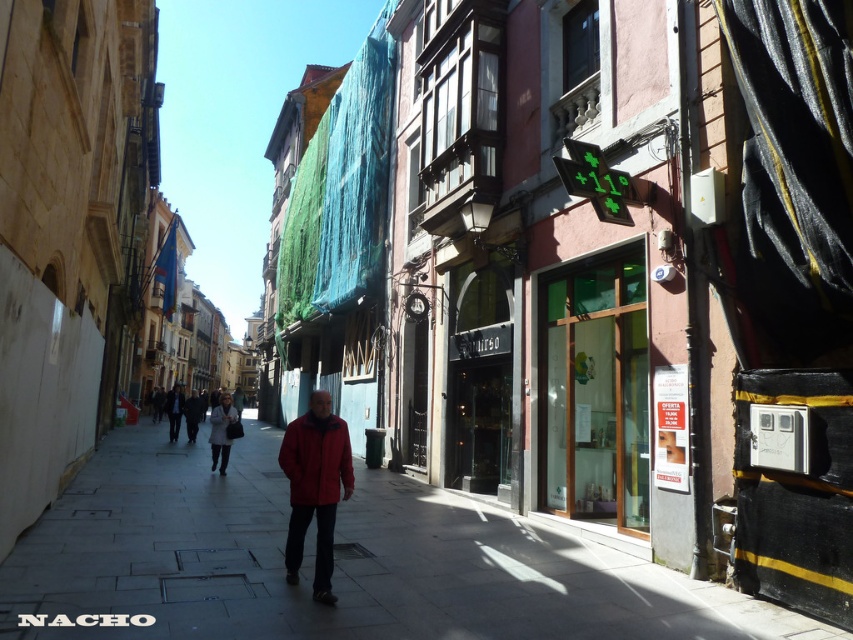
Can you confirm if red matte jacket at center is smaller than matte black jacket at center?

Incorrect, red matte jacket at center is not smaller in size than matte black jacket at center.

Between red matte jacket at center and matte black jacket at center, which one has more height?

red matte jacket at center is taller.

Is point (329, 496) more distant than point (225, 408)?

No, it is not.

Find the location of `red matte jacket at center`. red matte jacket at center is located at coordinates (315, 486).

Can you confirm if gray concrete pavement at center is positioned to the right of red matte jacket at center?

Incorrect, gray concrete pavement at center is not on the right side of red matte jacket at center.

Does gray concrete pavement at center have a smaller size compared to red matte jacket at center?

No.

This screenshot has width=853, height=640. Identify the location of gray concrete pavement at center. (334, 563).

Between dark gray suit at center and dark gray jacket at center, which one is positioned higher?

dark gray suit at center

Is point (178, 388) closer to camera compared to point (195, 404)?

No, it is not.

Locate an element on the screen. The image size is (853, 640). dark gray suit at center is located at coordinates (173, 410).